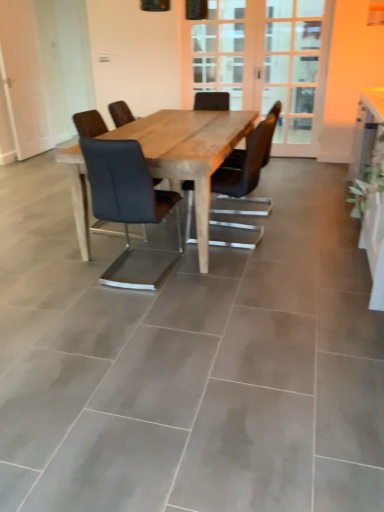
Find the location of a particular element. This screenshot has height=512, width=384. free spot in front of matte black chair at center, the second chair in the right-to-left sequence is located at coordinates (139, 306).